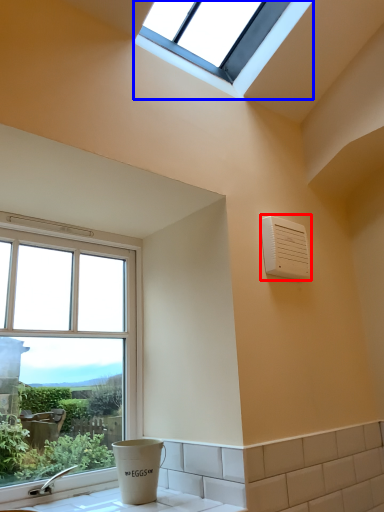
Question: Among these objects, which one is farthest to the camera, air conditioning (highlighted by a red box) or window (highlighted by a blue box)?

Choices:
 (A) air conditioning
 (B) window

Answer: (A)